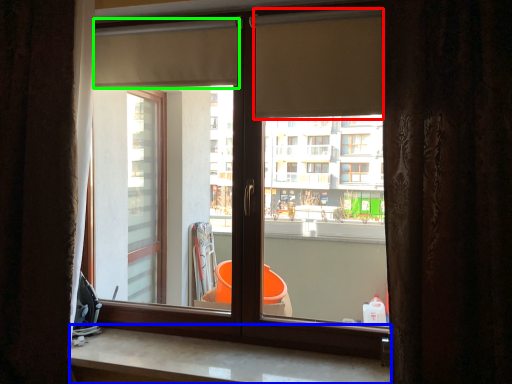
Question: Estimate the real-world distances between objects in this image. Which object is farther from shutter (highlighted by a red box), counter top (highlighted by a blue box) or shutter (highlighted by a green box)?

Choices:
 (A) counter top
 (B) shutter

Answer: (A)